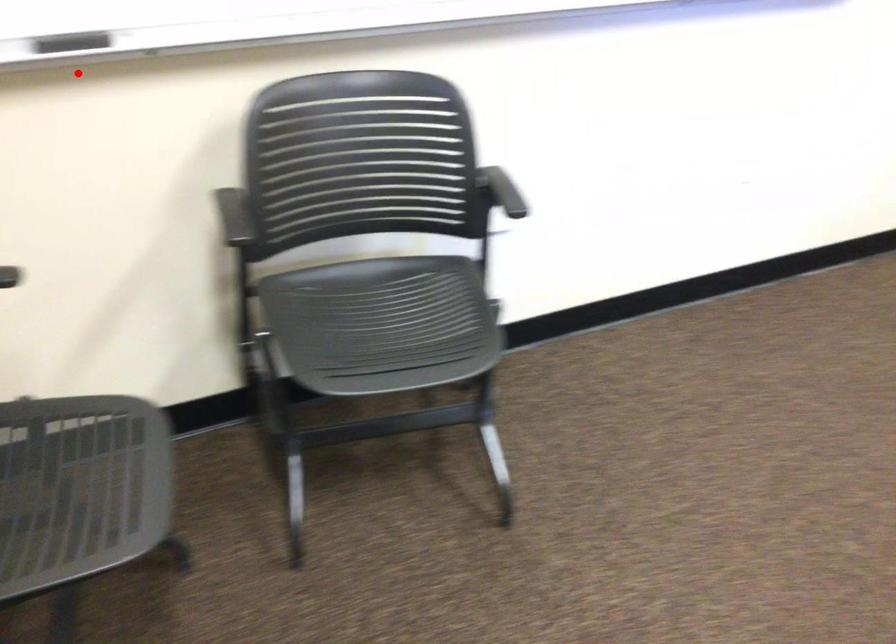
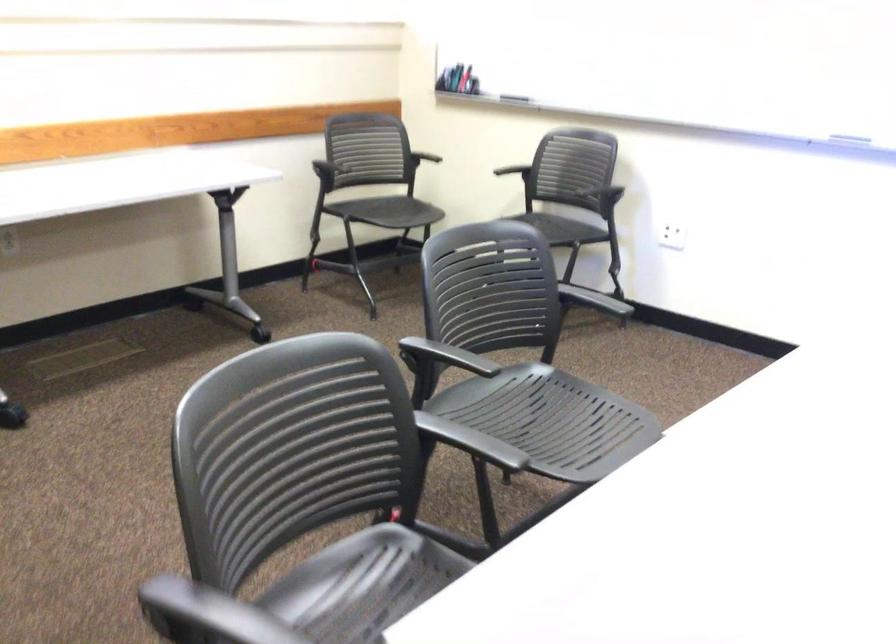
The point at the highlighted location is marked in the first image. Where is the corresponding point in the second image?

(514, 98)